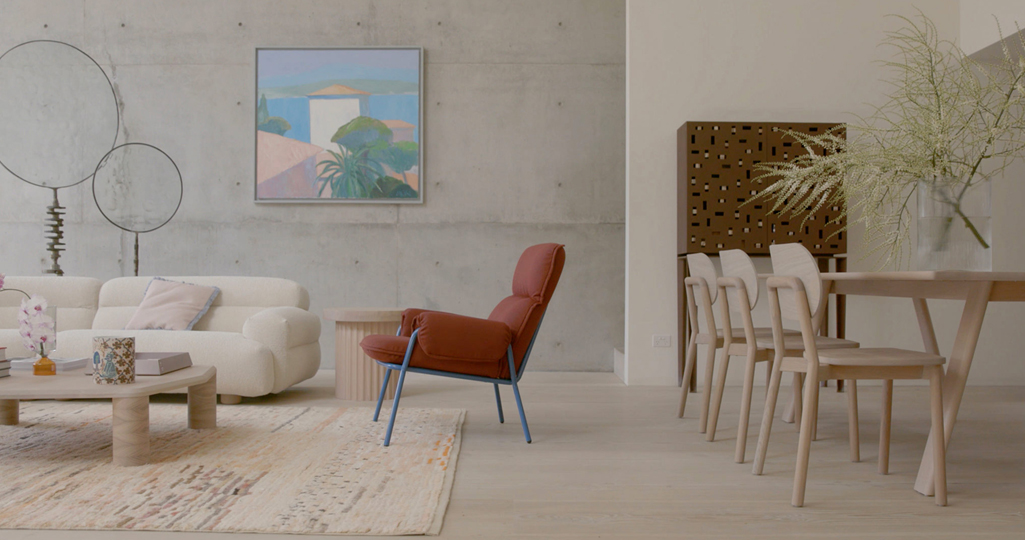
Locate an element on the screen. The height and width of the screenshot is (540, 1025). table legs is located at coordinates (5, 407), (126, 430), (205, 400).